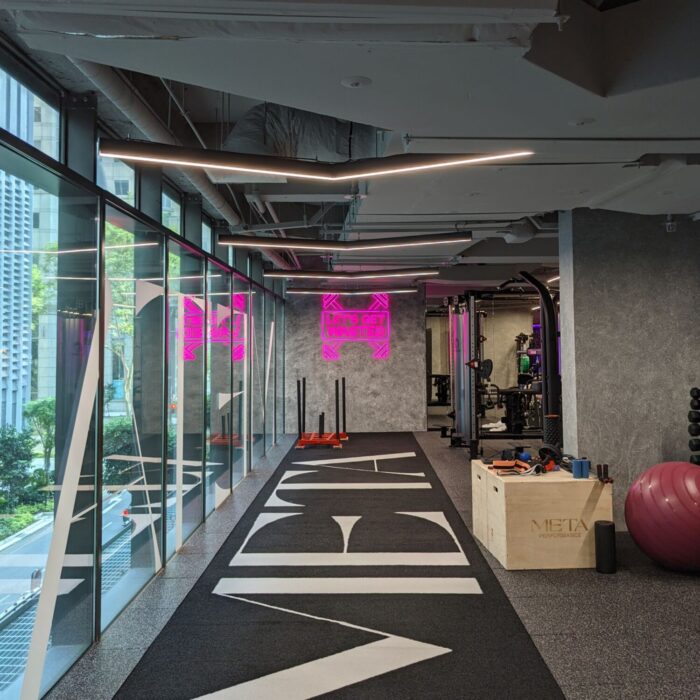
Find the location of `exposed hvac vents and tubes`. exposed hvac vents and tubes is located at coordinates (424, 197), (362, 60), (285, 130).